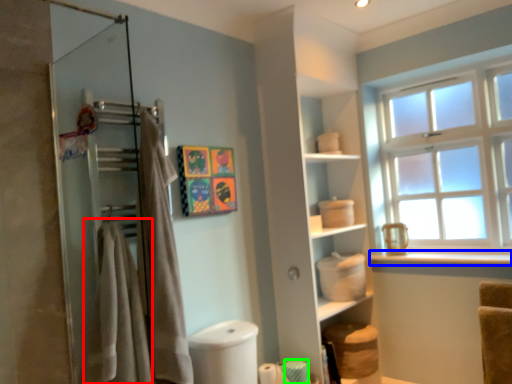
Question: Which object is the closest to the bath towel (highlighted by a red box)? Choose among these: window sill (highlighted by a blue box) or toilet paper (highlighted by a green box).

Choices:
 (A) window sill
 (B) toilet paper

Answer: (B)